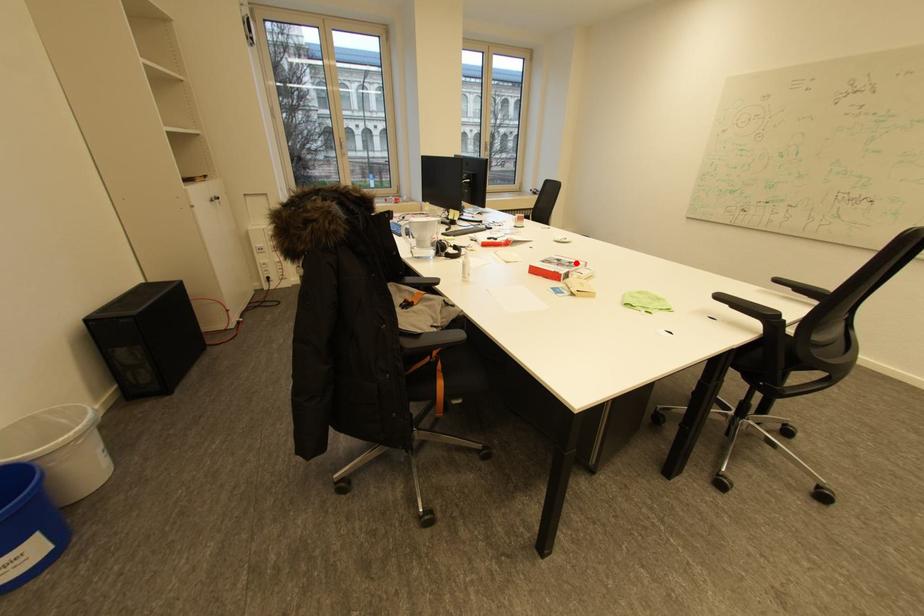
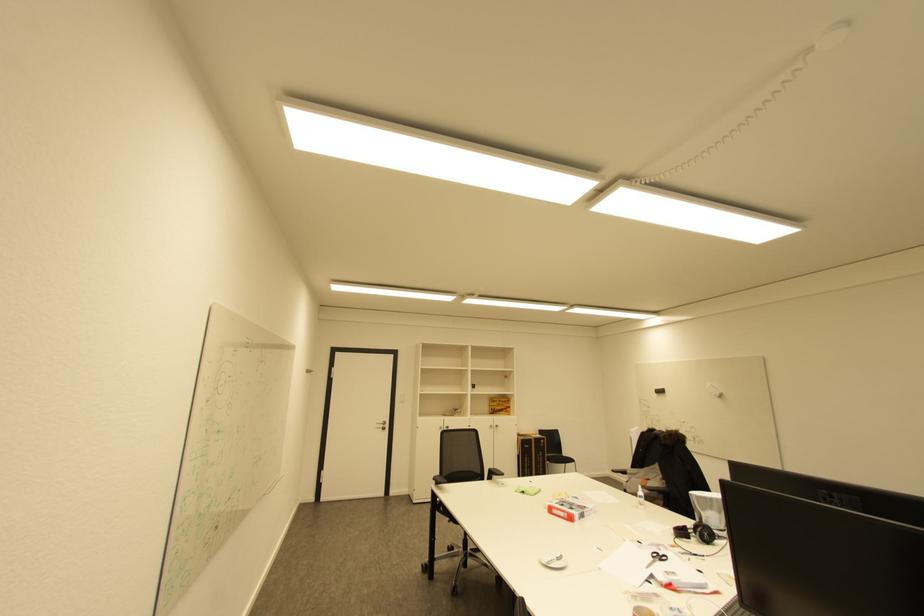
Question: A red point is marked in image1. In image2, is the corresponding 3D point closer to the camera or farther? Reply with the corresponding letter.

Choices:
 (A) The corresponding 3D point is closer.
 (B) The corresponding 3D point is farther.

Answer: (A)